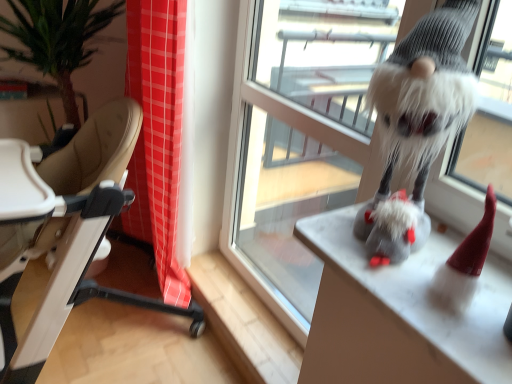
Image resolution: width=512 pixels, height=384 pixels. I want to click on vacant area that lies in front of fuzzy gray gnome at upper right, so click(x=400, y=279).